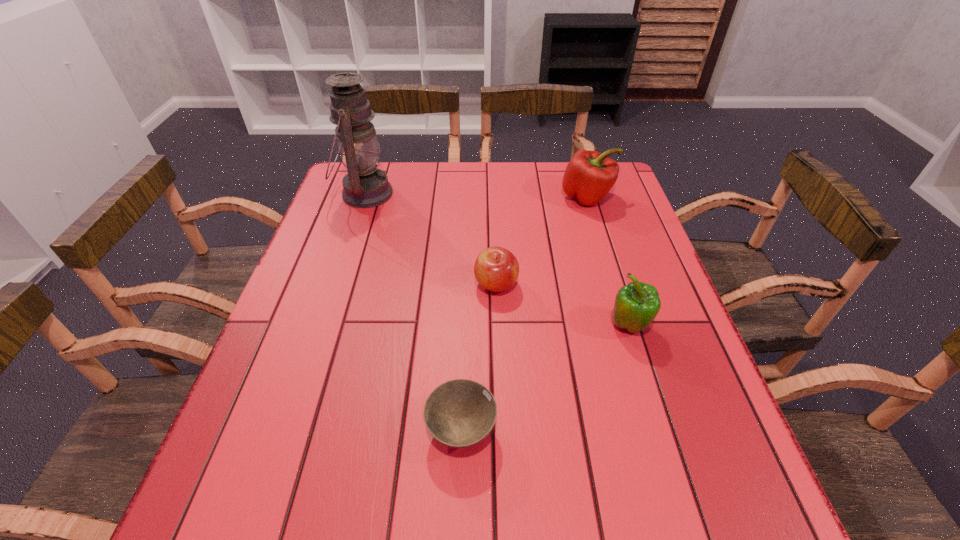
Find the location of a particular element. free space at the left edge of the desktop is located at coordinates (329, 215).

The width and height of the screenshot is (960, 540). Find the location of `vacant space at the right edge of the desktop`. vacant space at the right edge of the desktop is located at coordinates (627, 357).

Find the location of a particular element. vacant space in between the nearer bell pepper and the nearest object is located at coordinates [545, 378].

In order to click on vacant area that lies between the shortest object and the third farthest object in this screenshot , I will do `click(479, 357)`.

Image resolution: width=960 pixels, height=540 pixels. I want to click on vacant area between the third nearest object and the farther bell pepper, so click(x=541, y=241).

The image size is (960, 540). Find the location of `blank region between the farther bell pepper and the fourth tallest object`. blank region between the farther bell pepper and the fourth tallest object is located at coordinates (541, 241).

Locate an element on the screen. The width and height of the screenshot is (960, 540). vacant space in between the nearer bell pepper and the bowl is located at coordinates (545, 378).

This screenshot has width=960, height=540. I want to click on vacant area between the apple and the oil lamp, so click(x=430, y=239).

You are a GUI agent. You are given a task and a screenshot of the screen. Output one action in this format:
    pyautogui.click(x=<x>, y=<y>)
    Task: Click on the vacant space that is in between the tallest object and the third farthest object
    
    Given the screenshot: What is the action you would take?
    pyautogui.click(x=430, y=239)

This screenshot has height=540, width=960. What are the coordinates of `vacant area that lies between the fourth tallest object and the second nearest object` in the screenshot? It's located at (563, 306).